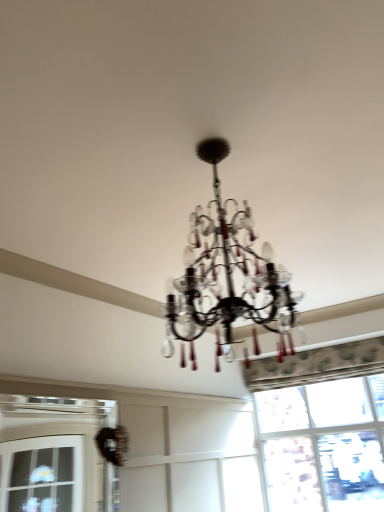
Question: Is clear glass window at lower left, which appears as the second window when viewed from the back, aimed at transparent glass window at lower right, acting as the 1th window starting from the back?

Choices:
 (A) no
 (B) yes

Answer: (A)

Question: Can transparent glass window at lower right, which is the 2th window from left to right, be found inside clear glass window at lower left, which appears as the second window when viewed from the right?

Choices:
 (A) yes
 (B) no

Answer: (B)

Question: Does clear glass window at lower left, which appears as the second window when viewed from the right, appear on the right side of transparent glass window at lower right, which is the 2th window from left to right?

Choices:
 (A) no
 (B) yes

Answer: (A)

Question: Considering the relative positions of clear glass window at lower left, which appears as the second window when viewed from the right, and transparent glass window at lower right, marked as the 2th window in a front-to-back arrangement, in the image provided, is clear glass window at lower left, which appears as the second window when viewed from the right, to the left of transparent glass window at lower right, marked as the 2th window in a front-to-back arrangement, from the viewer's perspective?

Choices:
 (A) no
 (B) yes

Answer: (B)

Question: Does clear glass window at lower left, which appears as the second window when viewed from the right, have a lesser height compared to transparent glass window at lower right, marked as the 2th window in a front-to-back arrangement?

Choices:
 (A) no
 (B) yes

Answer: (B)

Question: Is clear glass window at lower left, which appears as the second window when viewed from the right, far from transparent glass window at lower right, arranged as the 1th window when viewed from the right?

Choices:
 (A) no
 (B) yes

Answer: (B)

Question: Does transparent glass window at lower right, acting as the 1th window starting from the back, have a greater height compared to clear glass window at lower left, which appears as the second window when viewed from the back?

Choices:
 (A) yes
 (B) no

Answer: (A)

Question: From the image's perspective, is transparent glass window at lower right, arranged as the 1th window when viewed from the right, located beneath clear glass window at lower left, the 1th window viewed from the front?

Choices:
 (A) no
 (B) yes

Answer: (B)

Question: Is transparent glass window at lower right, marked as the 2th window in a front-to-back arrangement, placed right next to clear glass window at lower left, the 1th window viewed from the front?

Choices:
 (A) yes
 (B) no

Answer: (B)

Question: From a real-world perspective, is transparent glass window at lower right, arranged as the 1th window when viewed from the right, located higher than clear glass window at lower left, the 1th window viewed from the front?

Choices:
 (A) yes
 (B) no

Answer: (A)

Question: Is there a large distance between transparent glass window at lower right, arranged as the 1th window when viewed from the right, and clear glass window at lower left, the 1th window viewed from the front?

Choices:
 (A) yes
 (B) no

Answer: (A)

Question: From the image's perspective, is transparent glass window at lower right, acting as the 1th window starting from the back, located above clear glass window at lower left, the 1th window when ordered from left to right?

Choices:
 (A) no
 (B) yes

Answer: (A)

Question: Is transparent glass window at lower right, marked as the 2th window in a front-to-back arrangement, wider or thinner than clear glass window at lower left, the 1th window viewed from the front?

Choices:
 (A) thin
 (B) wide

Answer: (B)